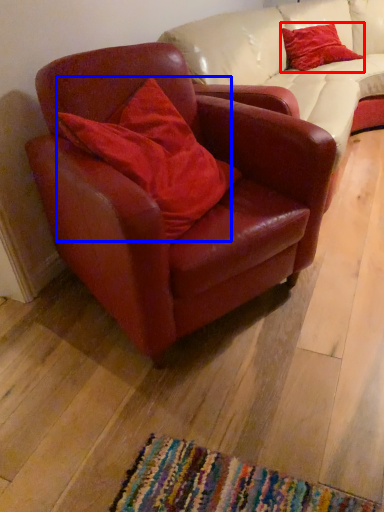
Question: Among these objects, which one is farthest to the camera, pillow (highlighted by a red box) or pillow (highlighted by a blue box)?

Choices:
 (A) pillow
 (B) pillow

Answer: (A)